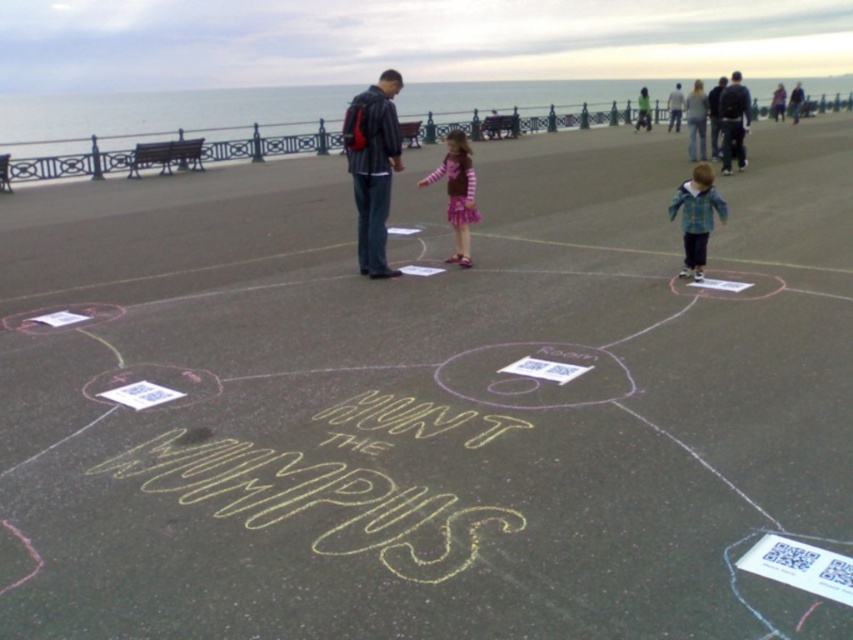
You are standing at the edge of the paved area and want to find the matte black jacket at center. According to the coordinates provided, in which direction should you walk from your current position to reach it?

Answer: The matte black jacket at center is located at coordinates point (373, 166). Since you are at the edge of the paved area, you should walk towards the center of the paved area to reach it.

You are a photographer trying to capture a photo of the matte black jacket at center and the light gray shirt at center. Based on their positions, which one should you focus on first if you want to include both in the frame without moving the camera?

The matte black jacket at center should be focused on first because it is positioned below the light gray shirt at center, so adjusting focus to the lower area will ensure both are in the frame.

You are a photographer positioned at the edge of the paved area. You want to take a photo that includes both the striped fabric dress at center and the light gray shirt at center. Which object should you focus on first to ensure both are in clear focus?

You should focus on the striped fabric dress at center first because it is closer to the viewer than the light gray shirt at center. By focusing on the closer object, the farther one will still be within the depth of field, ensuring both are in clear focus.